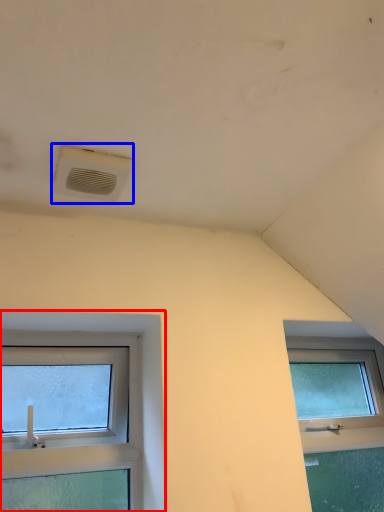
Question: Which of the following is the farthest to the observer, window (highlighted by a red box) or air conditioning (highlighted by a blue box)?

Choices:
 (A) window
 (B) air conditioning

Answer: (A)